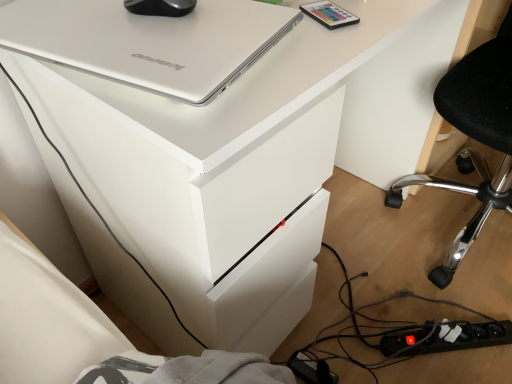
Question: Can you confirm if matte plastic remote control at upper right is positioned to the right of black plastic chair at lower right?

Choices:
 (A) no
 (B) yes

Answer: (A)

Question: Is matte plastic remote control at upper right to the left of black plastic chair at lower right from the viewer's perspective?

Choices:
 (A) no
 (B) yes

Answer: (B)

Question: Is matte plastic remote control at upper right shorter than black plastic chair at lower right?

Choices:
 (A) no
 (B) yes

Answer: (B)

Question: Is matte plastic remote control at upper right completely or partially outside of black plastic chair at lower right?

Choices:
 (A) no
 (B) yes

Answer: (B)

Question: Is matte plastic remote control at upper right positioned behind black plastic chair at lower right?

Choices:
 (A) no
 (B) yes

Answer: (B)

Question: Based on their sizes in the image, would you say black rubberized mouse at upper center is bigger or smaller than silver metallic laptop at upper left?

Choices:
 (A) small
 (B) big

Answer: (A)

Question: From the image's perspective, is black rubberized mouse at upper center above or below silver metallic laptop at upper left?

Choices:
 (A) below
 (B) above

Answer: (B)

Question: Would you say black rubberized mouse at upper center is to the left or to the right of silver metallic laptop at upper left in the picture?

Choices:
 (A) right
 (B) left

Answer: (A)

Question: In terms of height, does black rubberized mouse at upper center look taller or shorter compared to silver metallic laptop at upper left?

Choices:
 (A) tall
 (B) short

Answer: (A)

Question: Considering their positions, is black rubberized mouse at upper center located in front of or behind matte plastic remote control at upper right?

Choices:
 (A) behind
 (B) front

Answer: (B)

Question: Is black rubberized mouse at upper center bigger or smaller than matte plastic remote control at upper right?

Choices:
 (A) small
 (B) big

Answer: (B)

Question: From a real-world perspective, relative to matte plastic remote control at upper right, is black rubberized mouse at upper center vertically above or below?

Choices:
 (A) below
 (B) above

Answer: (B)

Question: Would you say black rubberized mouse at upper center is to the left or to the right of matte plastic remote control at upper right in the picture?

Choices:
 (A) right
 (B) left

Answer: (B)

Question: From a real-world perspective, is black plastic power strip at lower right physically located above or below black rubberized mouse at upper center?

Choices:
 (A) above
 (B) below

Answer: (B)

Question: Considering the positions of black plastic power strip at lower right and black rubberized mouse at upper center in the image, is black plastic power strip at lower right wider or thinner than black rubberized mouse at upper center?

Choices:
 (A) wide
 (B) thin

Answer: (A)